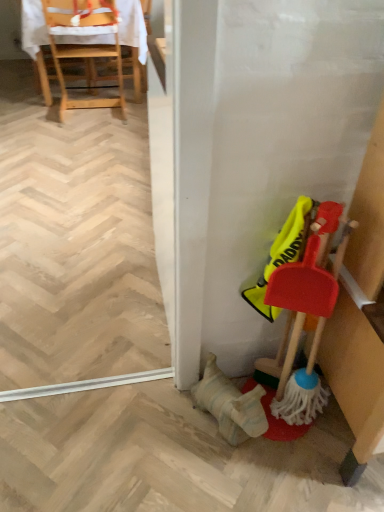
This screenshot has width=384, height=512. I want to click on vacant region under wooden chair at upper left (from a real-world perspective), so click(x=91, y=111).